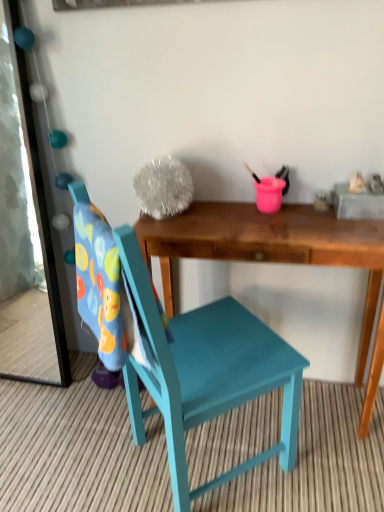
Find the location of a particular element. vacant space situated on the left part of teal painted wood chair at center is located at coordinates (76, 445).